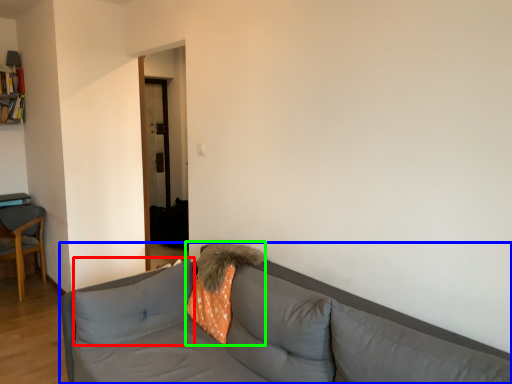
Question: Which is nearer to the pillow (highlighted by a red box)? studio couch (highlighted by a blue box) or throw pillow (highlighted by a green box).

Choices:
 (A) studio couch
 (B) throw pillow

Answer: (A)